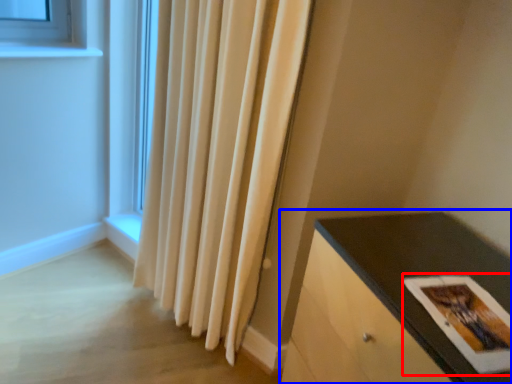
Question: Which of the following is the farthest to the observer, postcard (highlighted by a red box) or table (highlighted by a blue box)?

Choices:
 (A) postcard
 (B) table

Answer: (A)